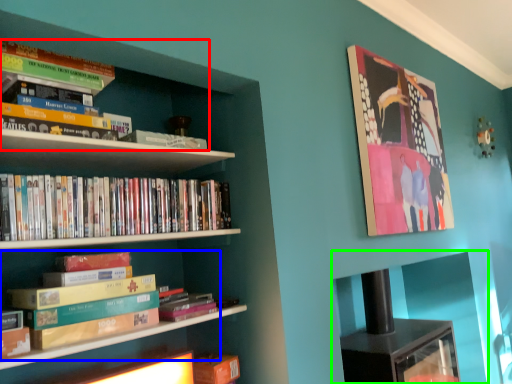
Question: Which object is the closest to the book (highlighted by a red box)? Choose among these: book (highlighted by a blue box) or cabinet (highlighted by a green box).

Choices:
 (A) book
 (B) cabinet

Answer: (A)